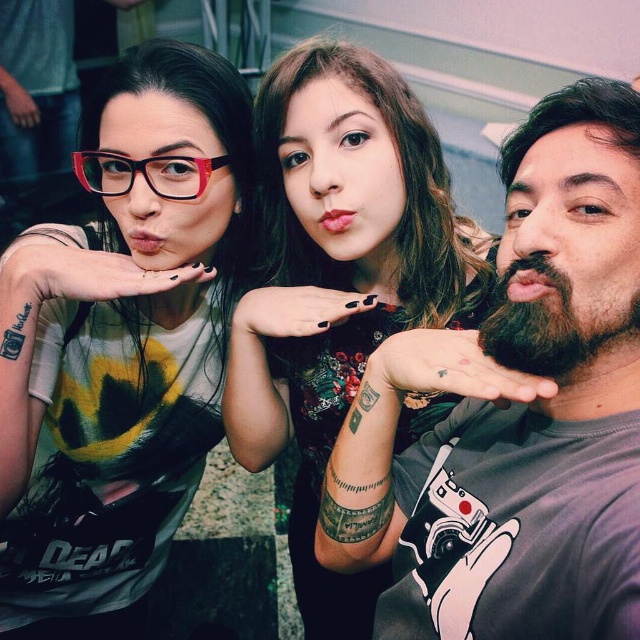
You are at a party and want to grab a drink. There are two glasses at the upper left corner of the table. Which one is on the left side when looking at the matte black glasses at upper left and the translucent plastic glasses at upper left?

The matte black glasses at upper left is positioned on the left side of the translucent plastic glasses at upper left, so the matte black glasses at upper left is on the left.

Based on the photo, you are a photographer trying to capture a clear shot of the bearded man at center without any obstructions. Based on the scene, is the translucent plastic glasses at upper left blocking your view of him?

The bearded man at center is in front of the translucent plastic glasses at upper left, so the glasses are behind him and would not obstruct your view of him.

You are standing in front of the image and want to locate the matte black glasses at upper left. Where exactly would you look in terms of coordinates?

The matte black glasses at upper left are located at coordinates point [122,346].